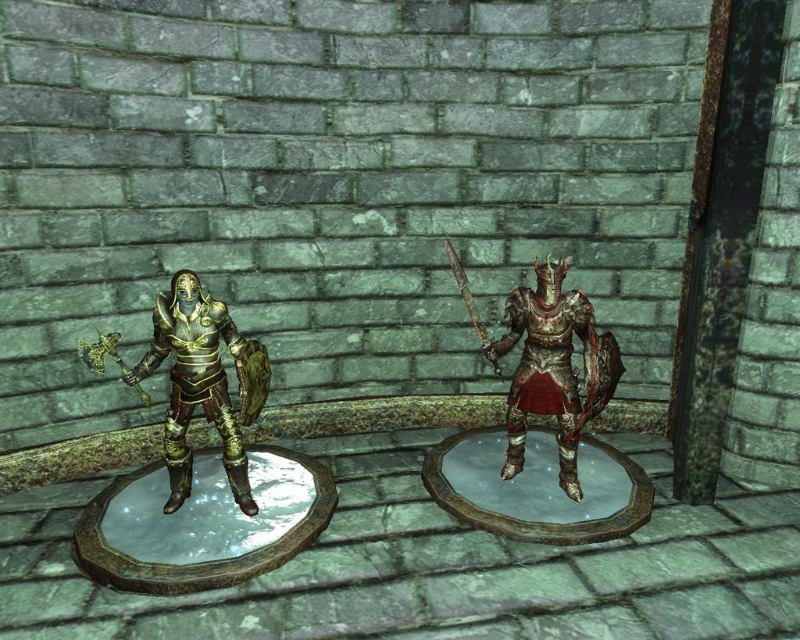
In the scene shown: Can you confirm if gold plated armor at left is positioned to the left of polished bronze armor at center?

Indeed, gold plated armor at left is positioned on the left side of polished bronze armor at center.

The height and width of the screenshot is (640, 800). Find the location of `gold plated armor at left`. gold plated armor at left is located at coordinates (202, 381).

Is point (186, 291) positioned in front of point (530, 403)?

Yes, it is.

You are a GUI agent. You are given a task and a screenshot of the screen. Output one action in this format:
    pyautogui.click(x=<x>, y=<y>)
    Task: Click on the gold plated armor at left
    
    Given the screenshot: What is the action you would take?
    click(x=202, y=381)